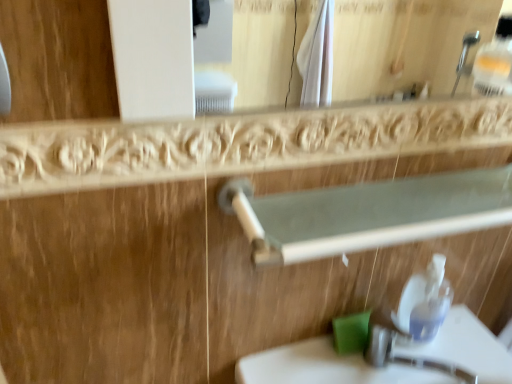
Find the location of `vacant space to the right of green matte soap at lower center`. vacant space to the right of green matte soap at lower center is located at coordinates (450, 356).